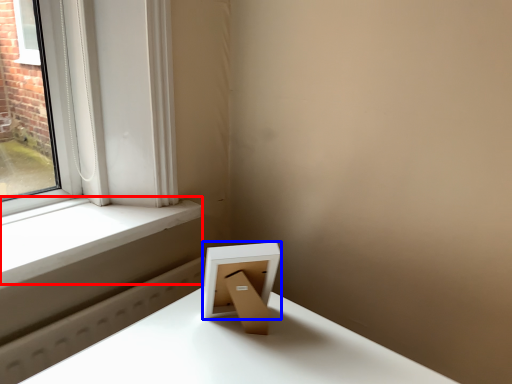
Question: Which object appears farthest to the camera in this image, window sill (highlighted by a red box) or picture frame (highlighted by a blue box)?

Choices:
 (A) window sill
 (B) picture frame

Answer: (A)